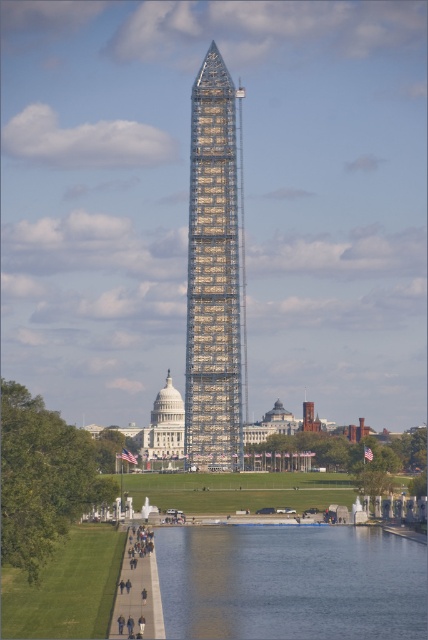
Question: Which of the following is the closest to the observer?

Choices:
 (A) shiny glass tower at center
 (B) smooth reflective water at lower center
 (C) dark gray concrete people at lower center

Answer: (C)

Question: Is smooth reflective water at lower center thinner than dark gray concrete people at lower center?

Choices:
 (A) no
 (B) yes

Answer: (A)

Question: Based on their relative distances, which object is nearer to the shiny glass tower at center?

Choices:
 (A) dark gray concrete people at lower center
 (B) smooth reflective water at lower center

Answer: (B)

Question: Is smooth reflective water at lower center smaller than dark gray concrete people at lower center?

Choices:
 (A) yes
 (B) no

Answer: (B)

Question: Is smooth reflective water at lower center above shiny glass tower at center?

Choices:
 (A) no
 (B) yes

Answer: (A)

Question: Based on their relative distances, which object is nearer to the shiny glass tower at center?

Choices:
 (A) smooth reflective water at lower center
 (B) dark gray concrete people at lower center

Answer: (A)